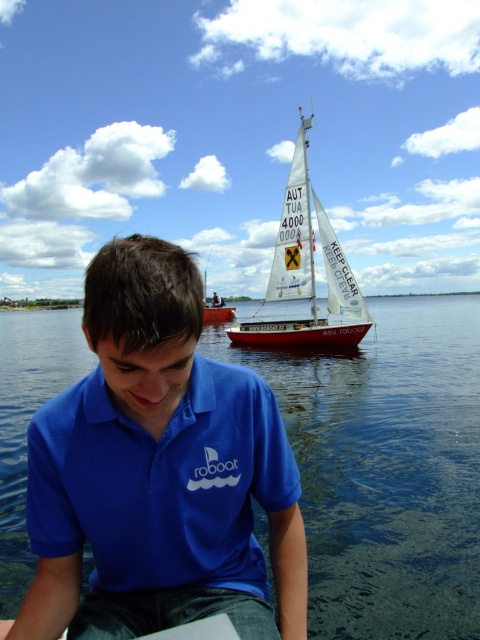
Question: Can you confirm if transparent blue water at lower center is positioned above red matte sailboat at center?

Choices:
 (A) no
 (B) yes

Answer: (B)

Question: Among these objects, which one is farthest from the camera?

Choices:
 (A) blue cotton polo shirt at center
 (B) red matte sailboat at center
 (C) white sailboat at upper center

Answer: (C)

Question: Can you confirm if transparent blue water at lower center is wider than red matte sailboat at center?

Choices:
 (A) yes
 (B) no

Answer: (A)

Question: Where is white sailboat at upper center located in relation to red matte sailboat at center in the image?

Choices:
 (A) above
 (B) below

Answer: (A)

Question: Based on their relative distances, which object is nearer to the transparent blue water at lower center?

Choices:
 (A) white sailboat at upper center
 (B) red matte sailboat at center
 (C) blue cotton polo shirt at center

Answer: (A)

Question: Which object is the farthest from the white sailboat at upper center?

Choices:
 (A) transparent blue water at lower center
 (B) red matte sailboat at center

Answer: (B)